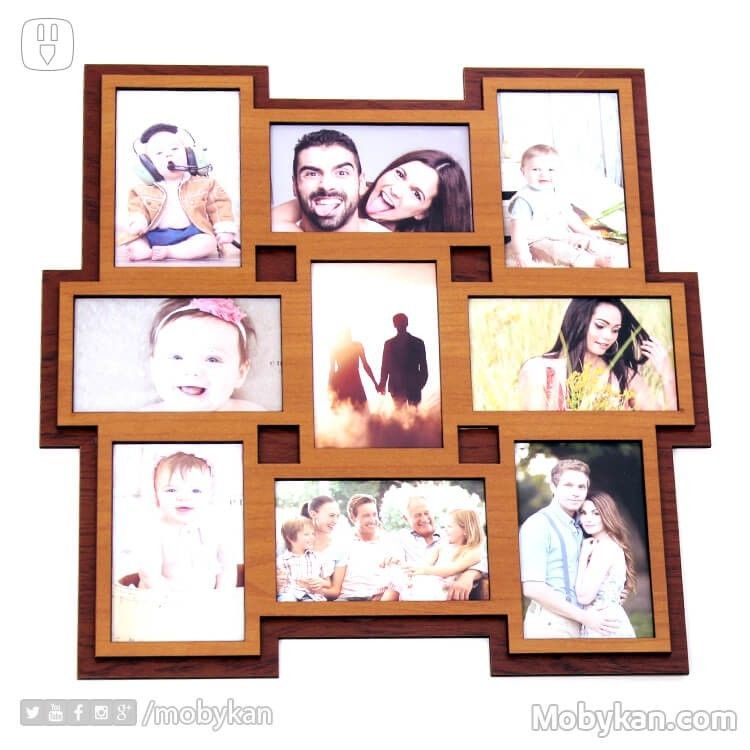
Identify the location of photos in collage. This screenshot has width=750, height=750. (212, 522), (334, 531), (525, 543), (532, 366), (417, 373), (235, 368), (196, 231), (340, 206), (525, 200).